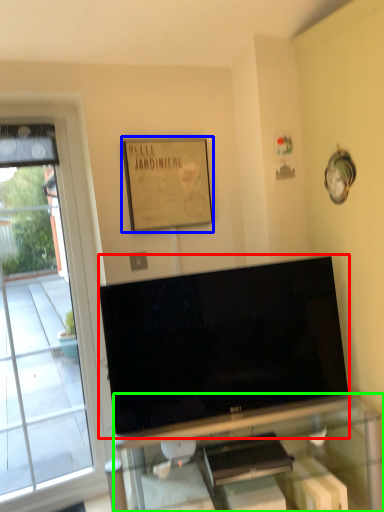
Question: Which object is the farthest from television (highlighted by a red box)? Choose among these: picture frame (highlighted by a blue box) or furniture (highlighted by a green box).

Choices:
 (A) picture frame
 (B) furniture

Answer: (A)